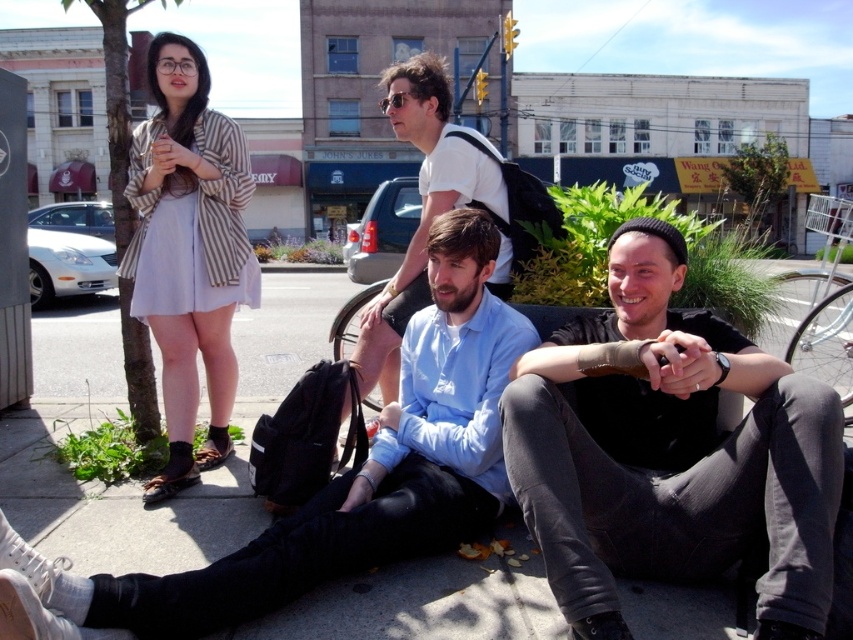
Looking at this image, you are standing at point (392, 104) and want to walk to point (340, 484). Which direction should you move relative to your current position?

You should move forward because point (340, 484) is in front of point (392, 104).